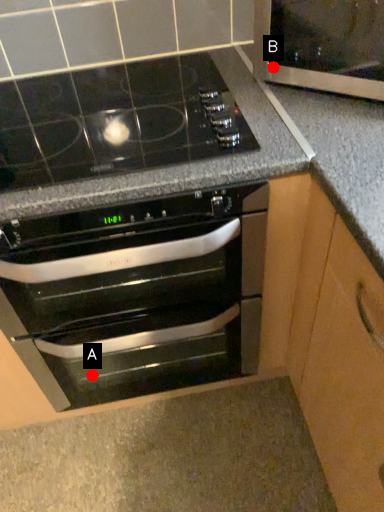
Question: Two points are circled on the image, labeled by A and B beside each circle. Which point appears closest to the camera in this image?

Choices:
 (A) A is closer
 (B) B is closer

Answer: (B)